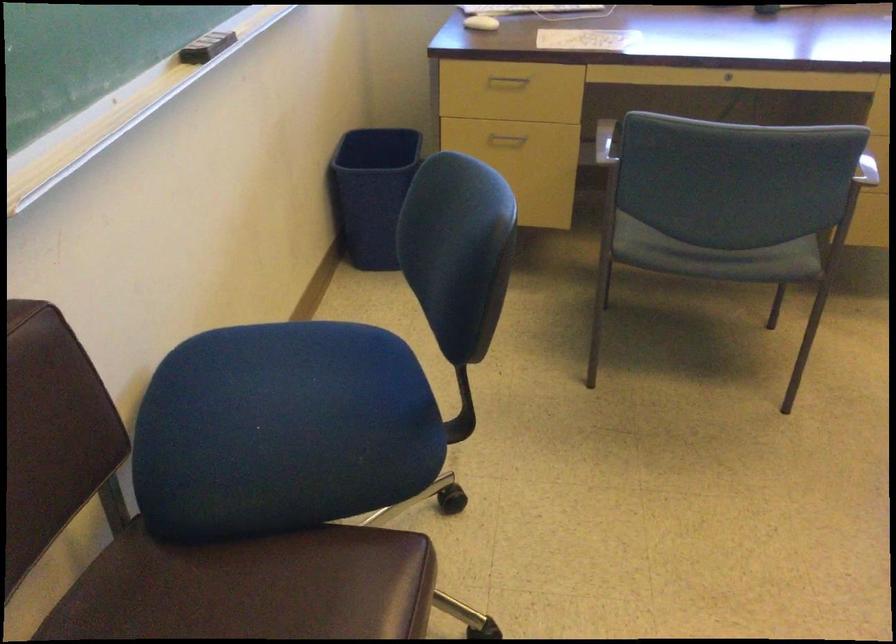
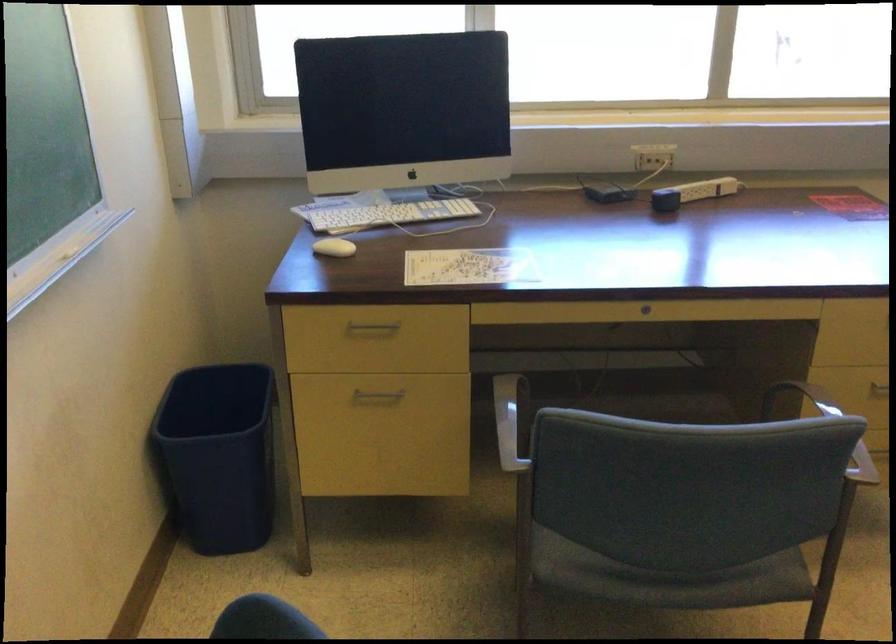
Locate, in the second image, the point that corresponds to [711,257] in the first image.

(668, 578)